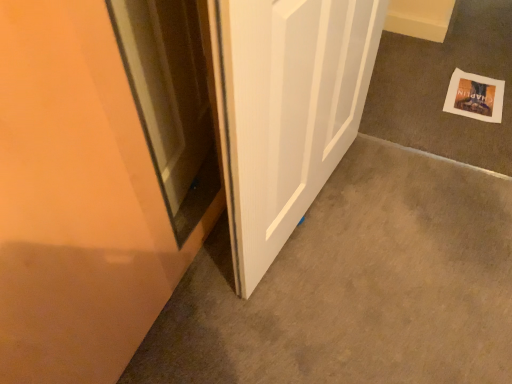
What is the approximate width of white paper at lower right?

white paper at lower right is 31.20 centimeters in width.

You are a GUI agent. You are given a task and a screenshot of the screen. Output one action in this format:
    pyautogui.click(x=<x>, y=<y>)
    Task: Click on the white paper at lower right
    
    Given the screenshot: What is the action you would take?
    coord(475,96)

Describe the element at coordinates (475, 96) in the screenshot. The width and height of the screenshot is (512, 384). I see `white paper at lower right` at that location.

Where is `white wood door at center`? The image size is (512, 384). white wood door at center is located at coordinates (286, 110).

The height and width of the screenshot is (384, 512). What do you see at coordinates (286, 110) in the screenshot?
I see `white wood door at center` at bounding box center [286, 110].

Locate an element on the screen. white paper at lower right is located at coordinates (475, 96).

Is white wood door at center at the right side of white paper at lower right?

No.

Which object is further away from the camera, white wood door at center or white paper at lower right?

white paper at lower right is further away from the camera.

Does point (350, 129) appear closer or farther from the camera than point (484, 116)?

Point (350, 129).

From the image's perspective, is white wood door at center located above or below white paper at lower right?

Based on their image positions, white wood door at center is located beneath white paper at lower right.

From a real-world perspective, is white wood door at center above or below white paper at lower right?

white wood door at center is above white paper at lower right.

Is white wood door at center thinner than white paper at lower right?

Yes, white wood door at center is thinner than white paper at lower right.

From the picture: Considering the sizes of objects white wood door at center and white paper at lower right in the image provided, who is shorter, white wood door at center or white paper at lower right?

Standing shorter between the two is white paper at lower right.

Can you confirm if white wood door at center is smaller than white paper at lower right?

No, white wood door at center is not smaller than white paper at lower right.

Is white wood door at center situated inside white paper at lower right or outside?

white wood door at center is spatially situated outside white paper at lower right.

Is white wood door at center next to white paper at lower right and touching it?

There is a gap between white wood door at center and white paper at lower right.

Is white wood door at center oriented towards white paper at lower right?

No, white wood door at center is not turned towards white paper at lower right.

How different are the orientations of white wood door at center and white paper at lower right in degrees?

83.1 degrees.

Identify the location of postcard that appears behind the white wood door at center. This screenshot has height=384, width=512. (475, 96).

Is white paper at lower right to the right of white wood door at center from the viewer's perspective?

Yes.

Is white paper at lower right in front of or behind white wood door at center in the image?

Visually, white paper at lower right is located behind white wood door at center.

Is point (452, 91) farther from viewer compared to point (261, 35)?

Yes, it is behind point (261, 35).

From the image's perspective, is white paper at lower right above or below white wood door at center?

white paper at lower right is situated higher than white wood door at center in the image.

From a real-world perspective, is white paper at lower right beneath white wood door at center?

Yes, from a real-world perspective, white paper at lower right is under white wood door at center.

Which object is thinner, white paper at lower right or white wood door at center?

Thinner between the two is white wood door at center.

Is white paper at lower right taller or shorter than white wood door at center?

Clearly, white paper at lower right is shorter compared to white wood door at center.

Does white paper at lower right have a larger size compared to white wood door at center?

No, white paper at lower right is not bigger than white wood door at center.

Which is correct: white paper at lower right is inside white wood door at center, or outside of it?

white paper at lower right is spatially situated outside white wood door at center.

Would you consider white paper at lower right to be distant from white wood door at center?

Result: white paper at lower right is actually quite close to white wood door at center.

Is white wood door at center at the back of white paper at lower right?

No.

How many degrees apart are the facing directions of white paper at lower right and white wood door at center?

The facing directions of white paper at lower right and white wood door at center are 83.1 degrees apart.

The image size is (512, 384). Find the location of `door above the white paper at lower right (from a real-world perspective)`. door above the white paper at lower right (from a real-world perspective) is located at coordinates coord(286,110).

Locate an element on the screen. This screenshot has width=512, height=384. postcard on the right side of white wood door at center is located at coordinates (475, 96).

You are a GUI agent. You are given a task and a screenshot of the screen. Output one action in this format:
    pyautogui.click(x=<x>, y=<y>)
    Task: Click on the door below the white paper at lower right (from the image's perspective)
    
    Given the screenshot: What is the action you would take?
    pyautogui.click(x=286, y=110)